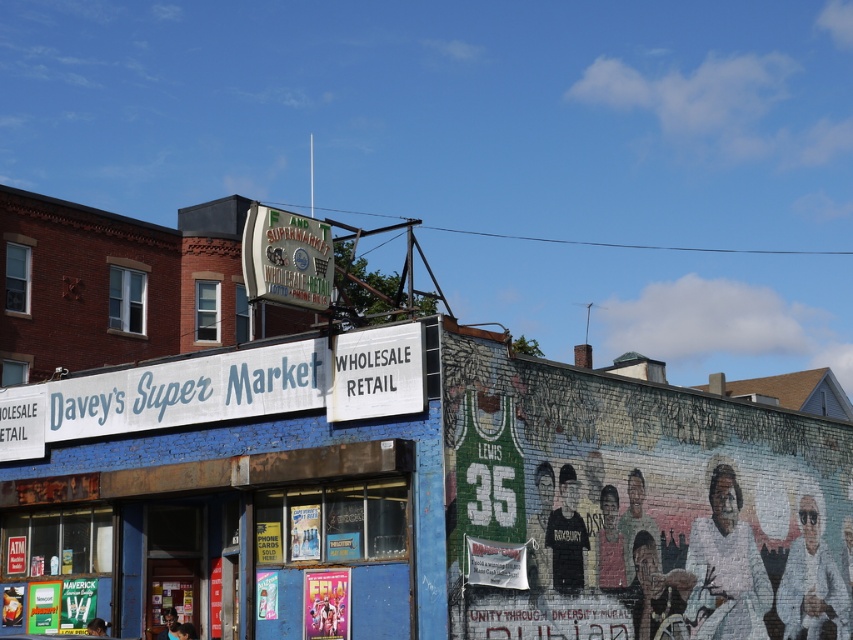
Measure the distance from blue painted brick davey's super market at center to painted brick mural at right.

They are 20.27 feet apart.

Where is `blue painted brick davey's super market at center`? blue painted brick davey's super market at center is located at coordinates (235, 490).

What do you see at coordinates (235, 490) in the screenshot? I see `blue painted brick davey's super market at center` at bounding box center [235, 490].

Locate an element on the screen. This screenshot has width=853, height=640. blue painted brick davey's super market at center is located at coordinates (235, 490).

Is painted brick mural at right bigger than white painted wood sign at upper center?

Correct, painted brick mural at right is larger in size than white painted wood sign at upper center.

Who is more distant from viewer, (788,620) or (286,278)?

Point (788,620)

Is point (674, 637) positioned after point (305, 221)?

Yes.

The width and height of the screenshot is (853, 640). Identify the location of painted brick mural at right. (637, 508).

The image size is (853, 640). What do you see at coordinates (235, 490) in the screenshot?
I see `blue painted brick davey's super market at center` at bounding box center [235, 490].

Is the position of blue painted brick davey's super market at center less distant than that of white painted wood sign at upper center?

Yes, it is in front of white painted wood sign at upper center.

Locate an element on the screen. The width and height of the screenshot is (853, 640). blue painted brick davey's super market at center is located at coordinates (235, 490).